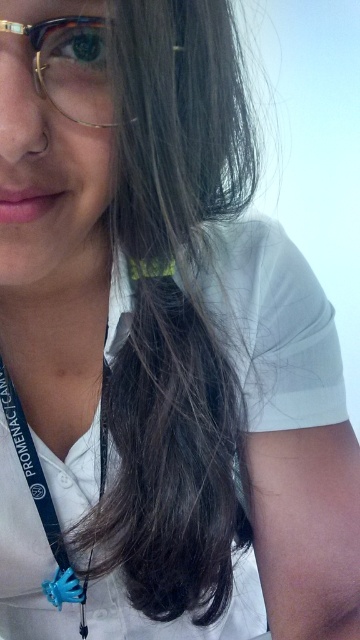
Question: In this image, where is white fabric at center located relative to blue rubber lanyard at center?

Choices:
 (A) below
 (B) above

Answer: (B)

Question: Which of the following is the farthest from the observer?

Choices:
 (A) (33, 305)
 (B) (101, 44)

Answer: (A)

Question: Which point is closer to the camera?

Choices:
 (A) (64, 454)
 (B) (101, 65)
 (C) (38, 484)

Answer: (B)

Question: Among these objects, which one is nearest to the camera?

Choices:
 (A) tortoiseshell acetate glasses at upper left
 (B) blue rubber lanyard at center
 (C) white fabric at center

Answer: (A)

Question: Can you confirm if white fabric at center is wider than tortoiseshell acetate glasses at upper left?

Choices:
 (A) no
 (B) yes

Answer: (B)

Question: Can you confirm if white fabric at center is positioned above blue rubber lanyard at center?

Choices:
 (A) yes
 (B) no

Answer: (A)